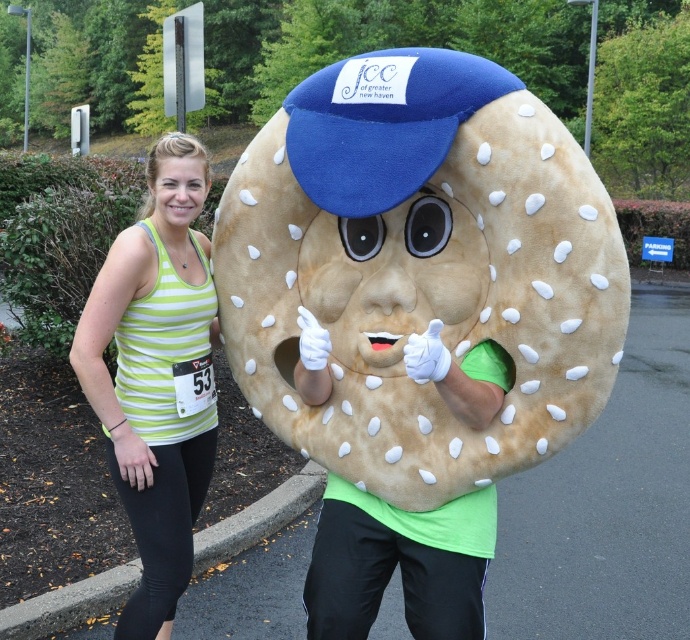
Is brown plush bagel at center further to the viewer compared to green striped tank top at center?

No, brown plush bagel at center is closer to the viewer.

Consider the image. How far apart are brown plush bagel at center and green striped tank top at center?

The distance of brown plush bagel at center from green striped tank top at center is 21.40 inches.

Find the location of a particular element. brown plush bagel at center is located at coordinates (420, 268).